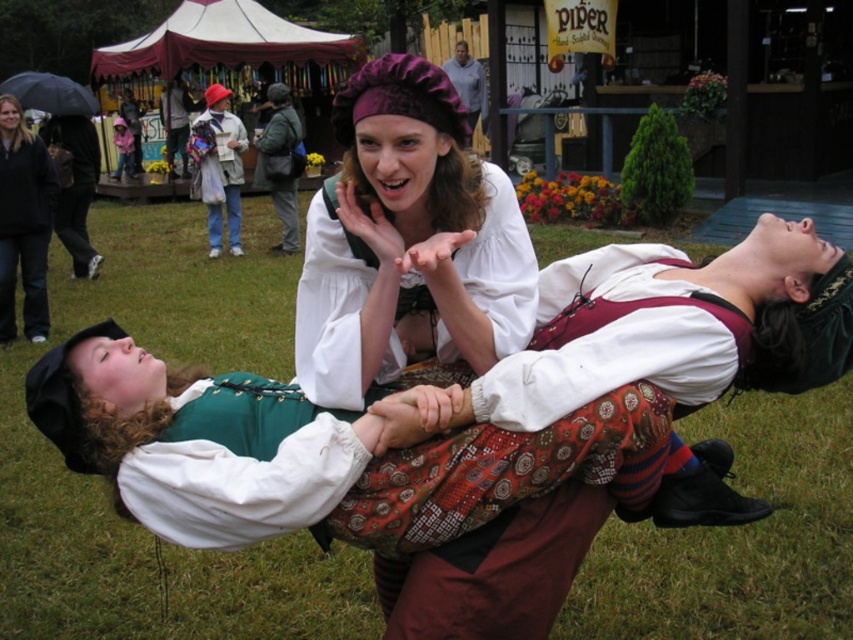
Question: Does white cotton blouse at center have a lesser width compared to pink fabric dress at center?

Choices:
 (A) yes
 (B) no

Answer: (A)

Question: Based on their relative distances, which object is farther from the black fabric umbrella at upper left?

Choices:
 (A) green fabric jacket at center
 (B) matte black jacket at upper center

Answer: (B)

Question: Which object is the closest to the denim jacket at upper center?

Choices:
 (A) white cotton blouse at center
 (B) black fabric umbrella at upper left
 (C) pink fabric dress at center
 (D) matte black jacket at upper center

Answer: (B)

Question: Does black fabric umbrella at upper left come behind matte purple hat at upper center?

Choices:
 (A) no
 (B) yes

Answer: (B)

Question: Which of the following is the farthest from the observer?

Choices:
 (A) denim jacket at left
 (B) denim jacket at upper center

Answer: (B)

Question: From the image, what is the correct spatial relationship of green fabric jacket at center in relation to pink fabric dress at center?

Choices:
 (A) right
 (B) left

Answer: (A)